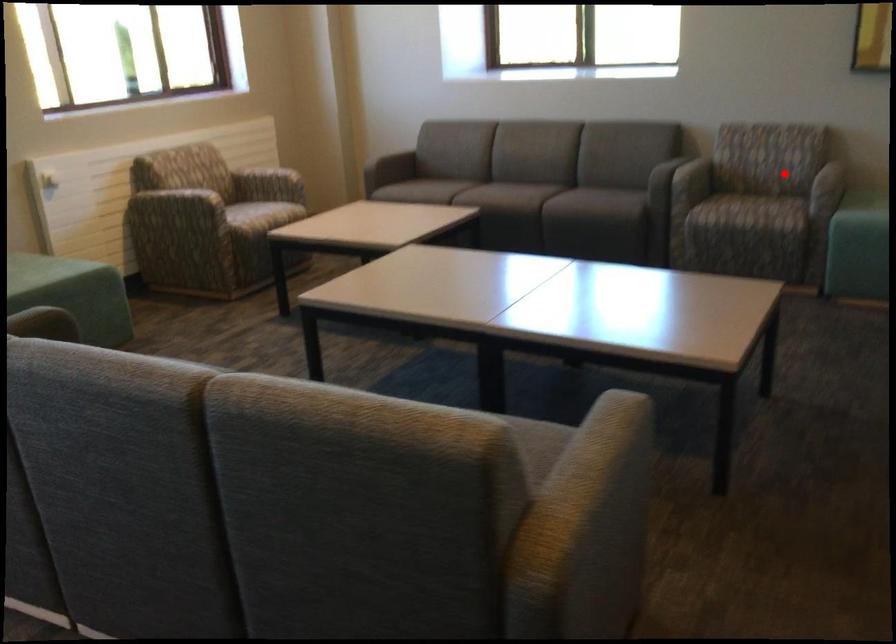
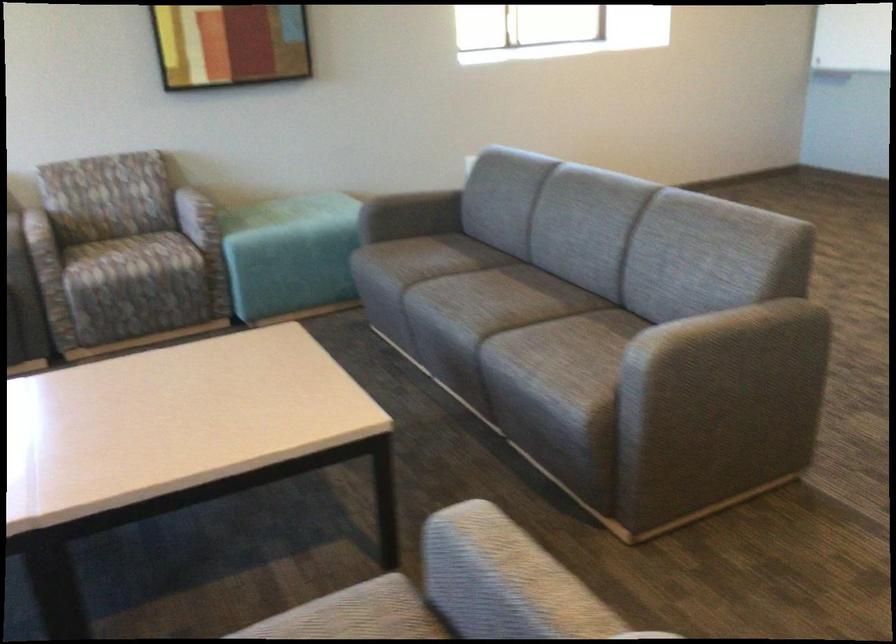
Where in the second image is the point corresponding to the highlighted location from the first image?

(197, 216)